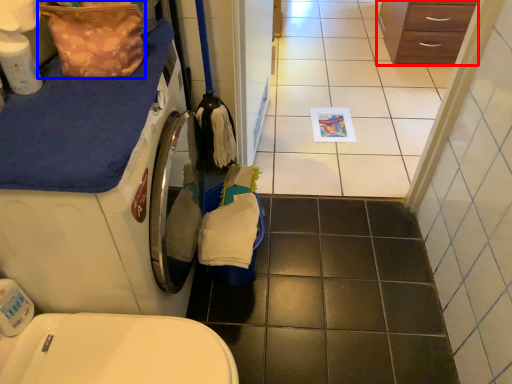
Question: Among these objects, which one is nearest to the camera, chest of drawers (highlighted by a red box) or material (highlighted by a blue box)?

Choices:
 (A) chest of drawers
 (B) material

Answer: (B)